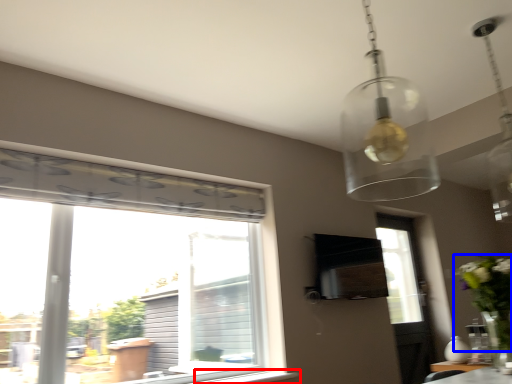
Question: Which object is closer to the camera taking this photo, window sill (highlighted by a red box) or floral arrangement (highlighted by a blue box)?

Choices:
 (A) window sill
 (B) floral arrangement

Answer: (B)